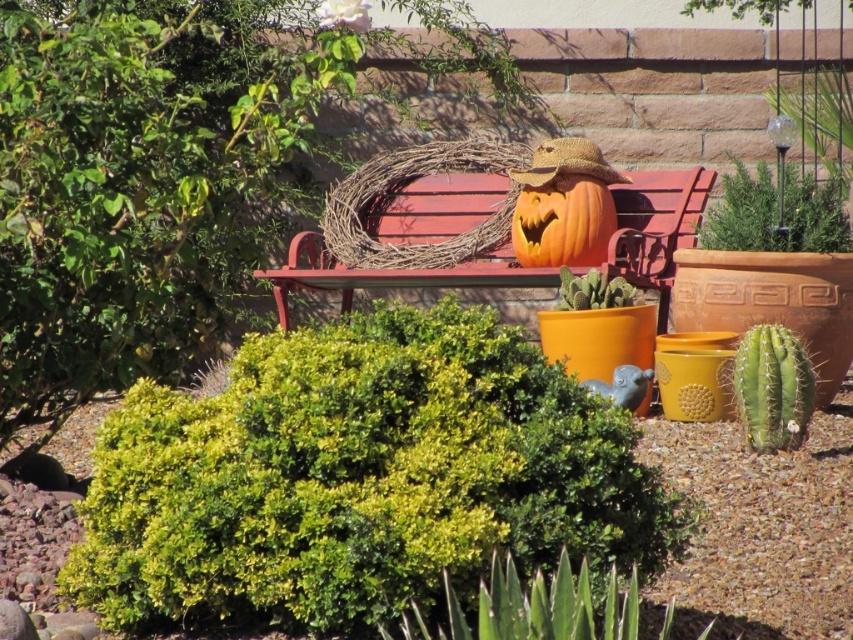
Does wooden bench at center appear over orange matte pumpkin at center?

Actually, wooden bench at center is below orange matte pumpkin at center.

Can you confirm if wooden bench at center is positioned to the left of orange matte pumpkin at center?

Yes, wooden bench at center is to the left of orange matte pumpkin at center.

This screenshot has width=853, height=640. I want to click on wooden bench at center, so (x=654, y=227).

Is green leafy bush at center above wooden bench at center?

No, green leafy bush at center is not above wooden bench at center.

Image resolution: width=853 pixels, height=640 pixels. I want to click on green leafy bush at center, so click(361, 477).

At what (x,y) coordinates should I click in order to perform the action: click on green leafy bush at center. Please return your answer as a coordinate pair (x, y). Image resolution: width=853 pixels, height=640 pixels. Looking at the image, I should click on (361, 477).

Is green leafy bush at center in front of orange matte pumpkin at center?

Yes, it is.

Between green leafy bush at center and orange matte pumpkin at center, which one appears on the left side from the viewer's perspective?

green leafy bush at center is more to the left.

Locate an element on the screen. The width and height of the screenshot is (853, 640). green leafy bush at center is located at coordinates (361, 477).

I want to click on green leafy bush at center, so click(361, 477).